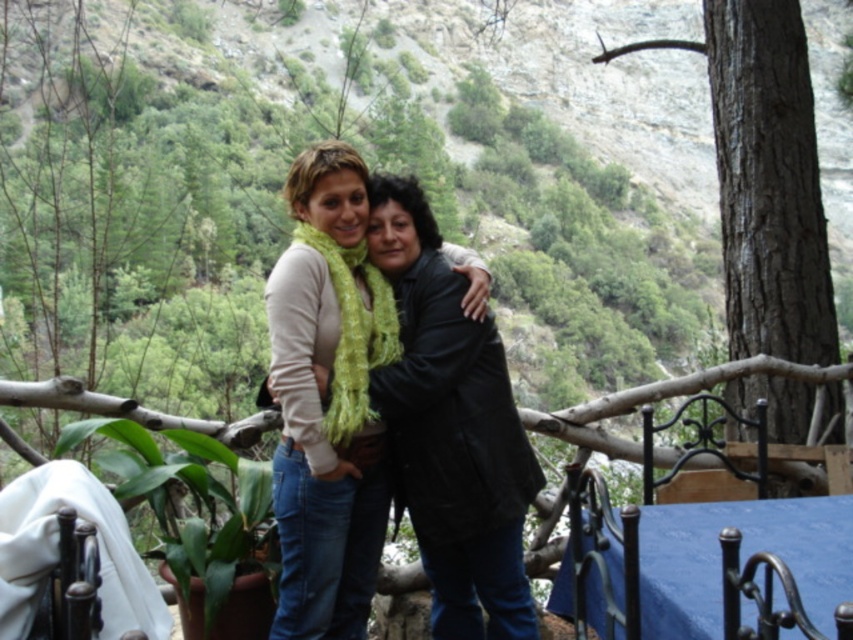
Question: Is light beige sweater at center below blue fabric tablecloth at lower right?

Choices:
 (A) no
 (B) yes

Answer: (A)

Question: Is light beige sweater at center thinner than blue fabric tablecloth at lower right?

Choices:
 (A) yes
 (B) no

Answer: (B)

Question: From the image, what is the correct spatial relationship of light beige sweater at center in relation to blue fabric tablecloth at lower right?

Choices:
 (A) left
 (B) right

Answer: (A)

Question: Among these points, which one is nearest to the camera?

Choices:
 (A) (851, 522)
 (B) (434, 364)

Answer: (A)